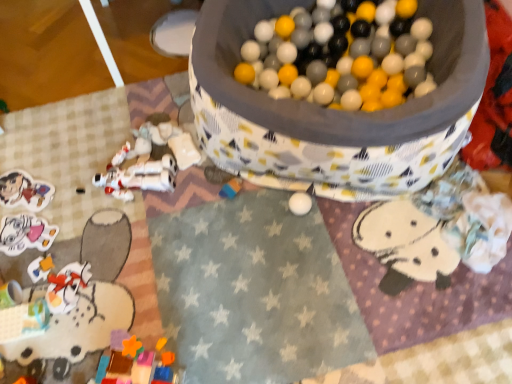
Locate an element on the screen. The height and width of the screenshot is (384, 512). free space between matte cardboard sticker at lower left, which is the first toy in left-to-right order, and matte white sticker at lower left, which appears as the 2th toy when viewed from the left is located at coordinates (39, 213).